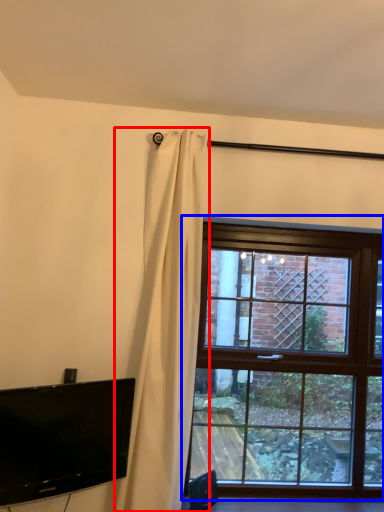
Question: Which of the following is the closest to the observer, curtain (highlighted by a red box) or window (highlighted by a blue box)?

Choices:
 (A) curtain
 (B) window

Answer: (A)